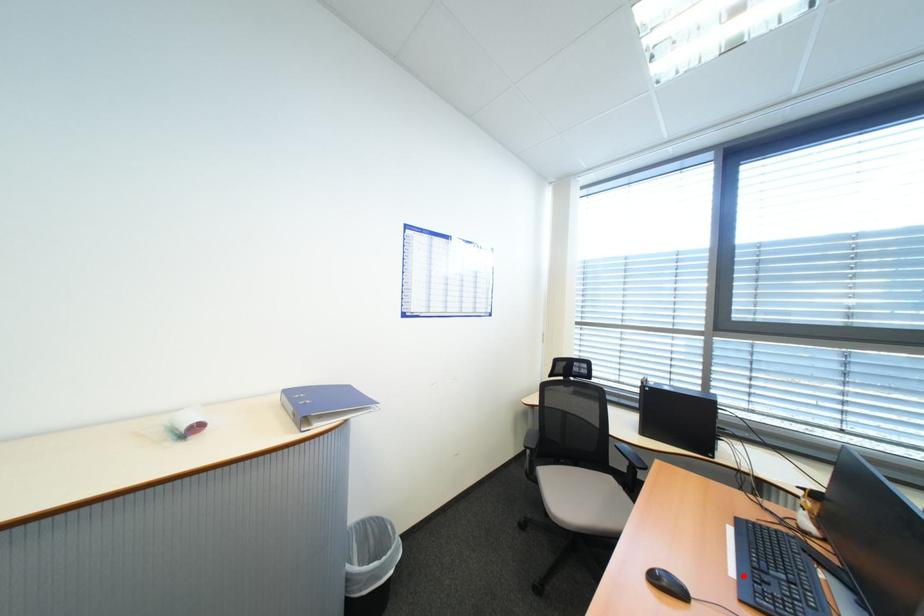
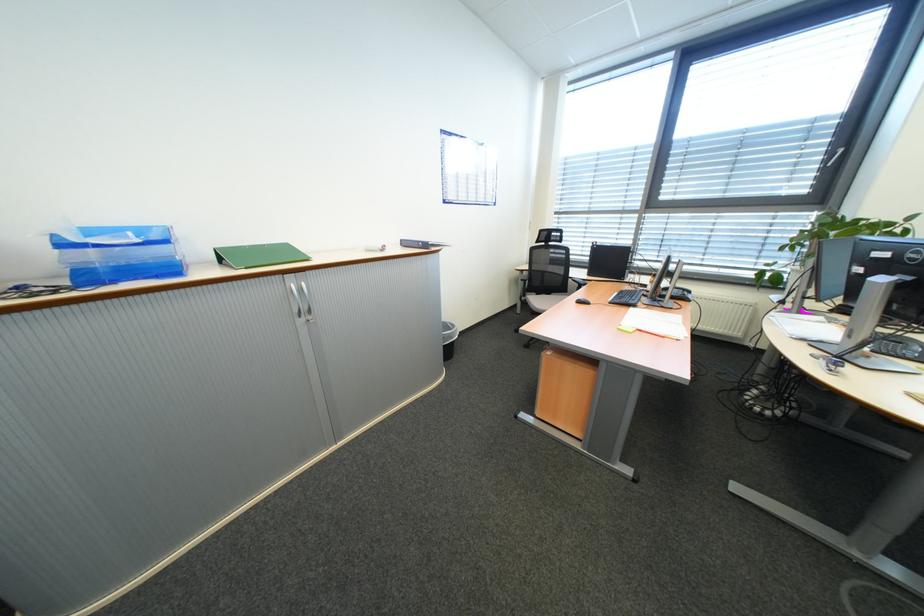
The point at the highlighted location is marked in the first image. Where is the corresponding point in the second image?

(619, 302)